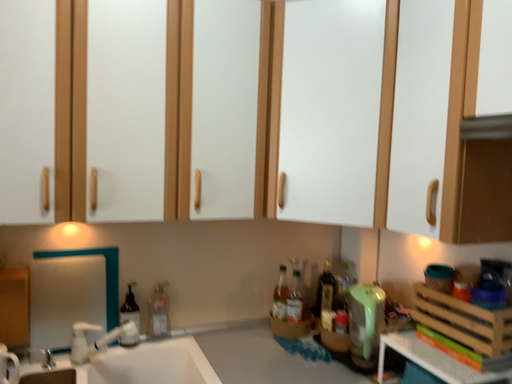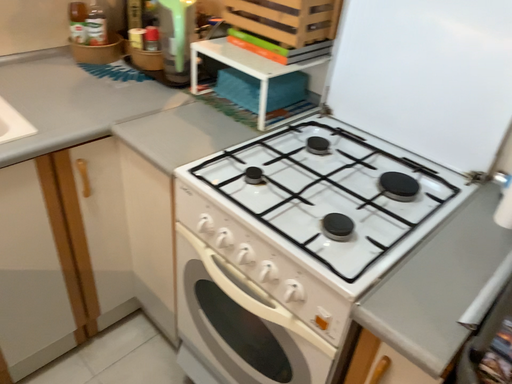
Question: How did the camera likely rotate when shooting the video?

Choices:
 (A) rotated downward
 (B) rotated upward

Answer: (A)